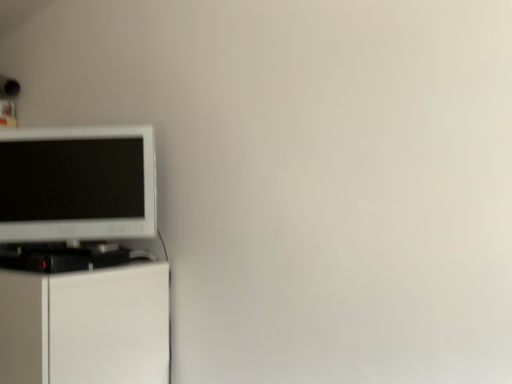
Identify the location of matte white monitor at left. (77, 183).

What do you see at coordinates (77, 183) in the screenshot? This screenshot has height=384, width=512. I see `matte white monitor at left` at bounding box center [77, 183].

Locate an element on the screen. matte white monitor at left is located at coordinates (77, 183).